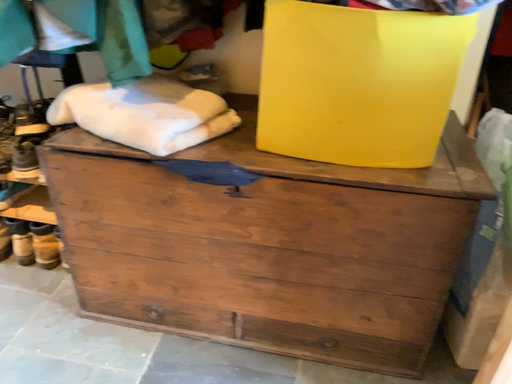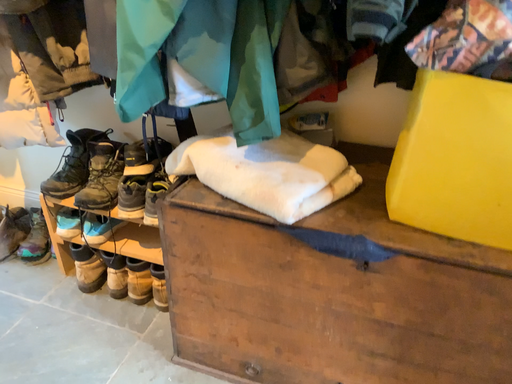
Question: Which way did the camera rotate in the video?

Choices:
 (A) rotated right
 (B) rotated left

Answer: (B)